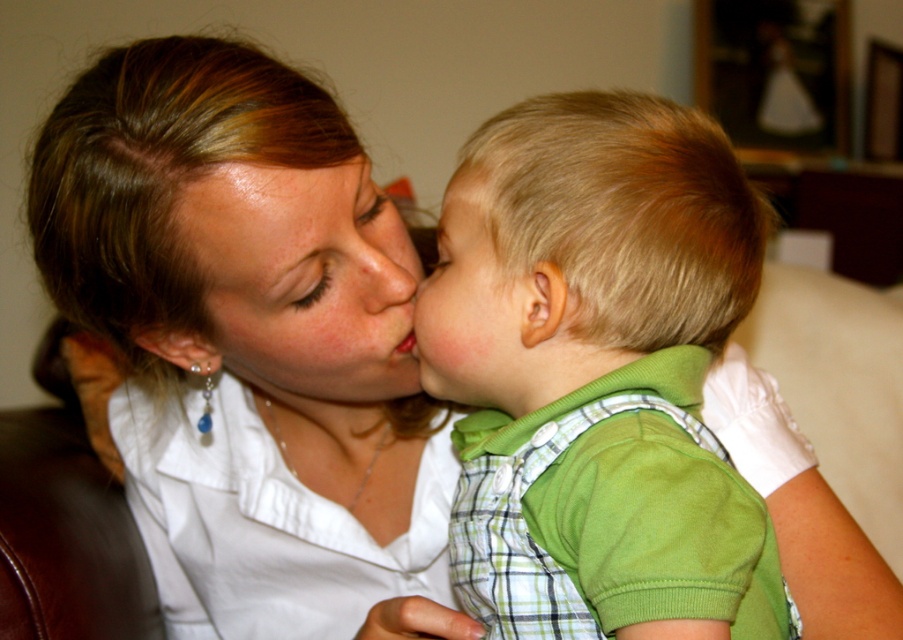
Question: Among these points, which one is farthest from the camera?

Choices:
 (A) (492, 340)
 (B) (414, 259)
 (C) (449, 200)
 (D) (234, 164)

Answer: (B)

Question: Is matte skin face at center bigger than matte green shirt at center?

Choices:
 (A) no
 (B) yes

Answer: (B)

Question: Which point appears closest to the camera in this image?

Choices:
 (A) (362, 307)
 (B) (501, 148)
 (C) (489, 195)
 (D) (510, 316)

Answer: (C)

Question: Which of these objects is positioned closest to the matte skin face at center?

Choices:
 (A) smooth skin nose at center
 (B) green plaid overalls at center
 (C) blonde hair at center

Answer: (A)

Question: Can you confirm if green plaid overalls at center is smaller than matte skin face at center?

Choices:
 (A) no
 (B) yes

Answer: (A)

Question: Considering the relative positions of green plaid overalls at center and matte green shirt at center in the image provided, where is green plaid overalls at center located with respect to matte green shirt at center?

Choices:
 (A) right
 (B) left

Answer: (A)